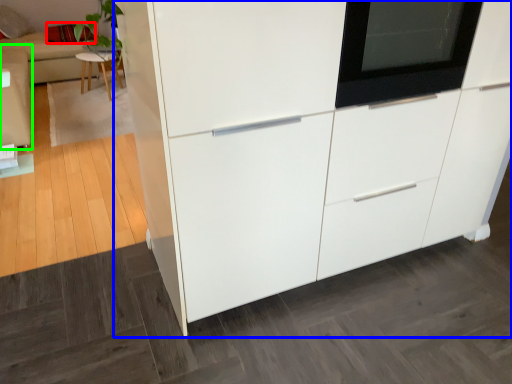
Question: Which is farther away from pillow (highlighted by a red box)? cabinetry (highlighted by a blue box) or couch (highlighted by a green box)?

Choices:
 (A) cabinetry
 (B) couch

Answer: (A)